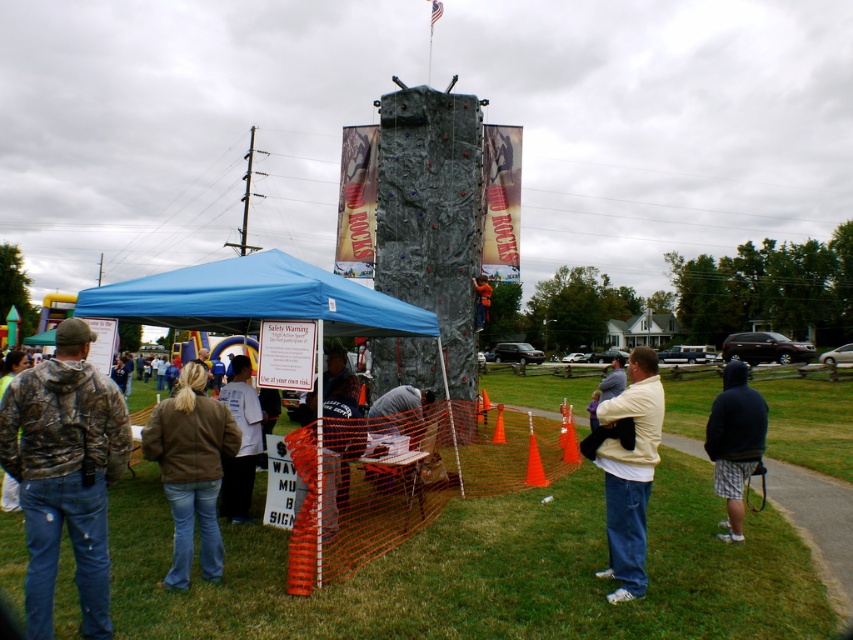
Question: Considering the real-world distances, which object is closest to the beige cotton jacket at lower right?

Choices:
 (A) brown leather jacket at lower left
 (B) white cotton shirt at center

Answer: (A)

Question: Does beige cotton jacket at lower right lie in front of orange safety vest at center?

Choices:
 (A) yes
 (B) no

Answer: (A)

Question: Is brown leather jacket at lower left below dark gray fabric shirt at center?

Choices:
 (A) no
 (B) yes

Answer: (A)

Question: Does blue fabric canopy at center appear under white cotton shirt at center?

Choices:
 (A) no
 (B) yes

Answer: (A)

Question: Which of the following is the farthest from the observer?

Choices:
 (A) dark blue hoodie at center
 (B) blue fabric canopy at center
 (C) white cotton shirt at center

Answer: (A)

Question: Which is farther from the white cotton shirt at center?

Choices:
 (A) brown leather jacket at lower left
 (B) camouflage jacket at lower left
 (C) dark blue hoodie at center

Answer: (C)